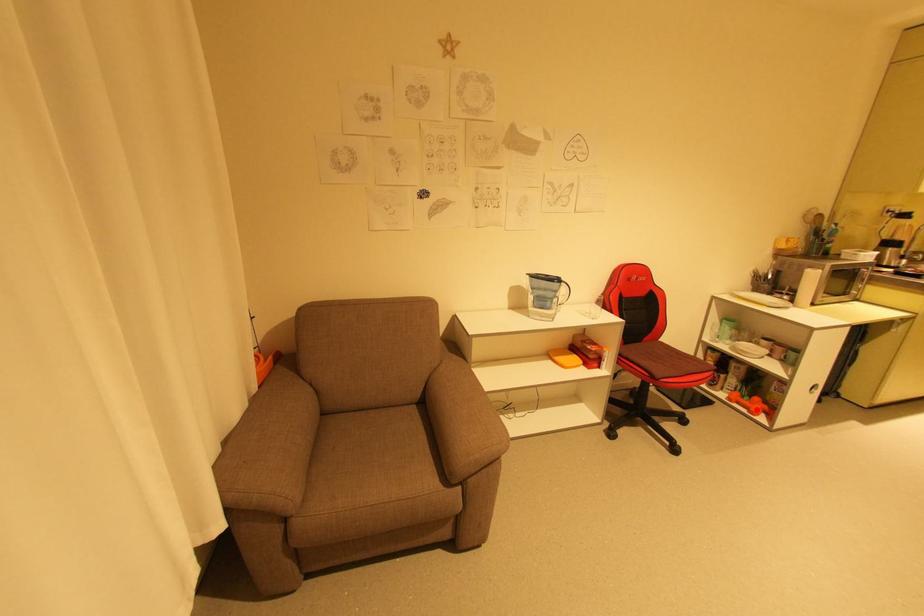
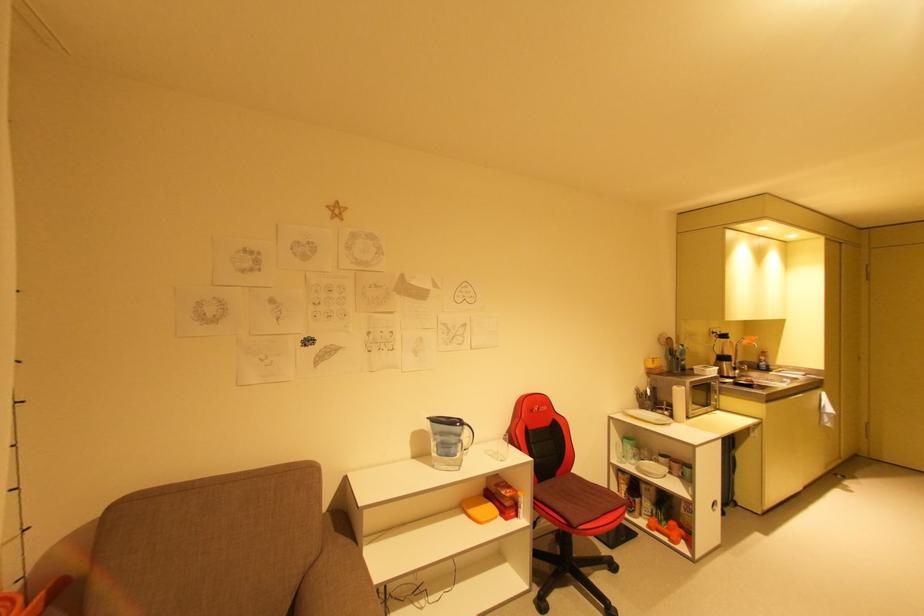
The point at the highlighted location is marked in the first image. Where is the corresponding point in the second image?

(675, 538)